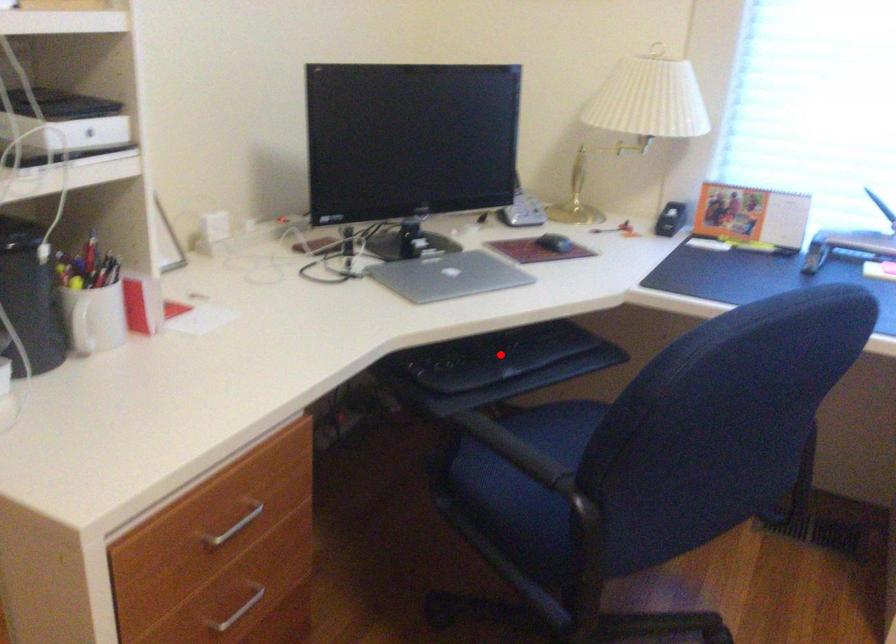
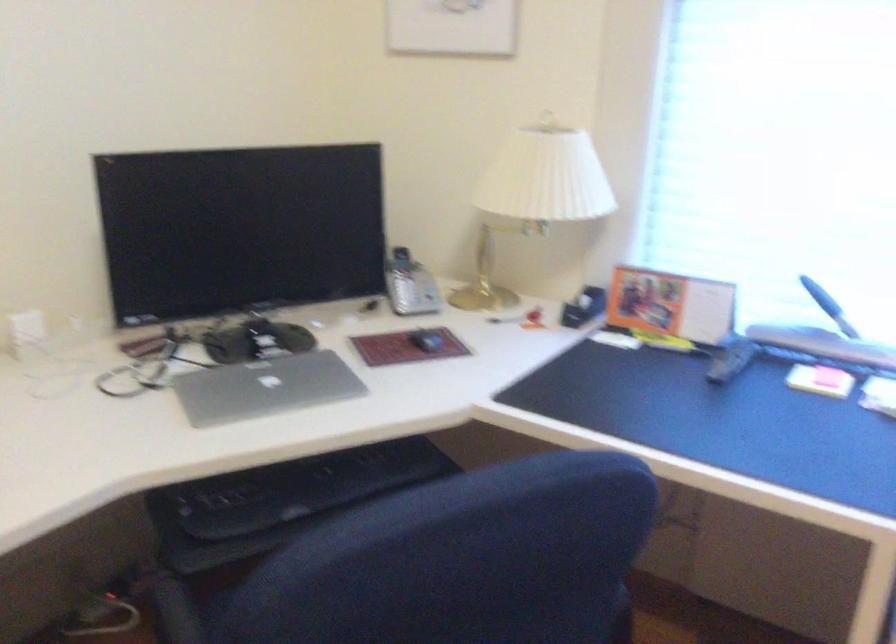
Where in the second image is the point corresponding to the highlighted location from the first image?

(302, 488)